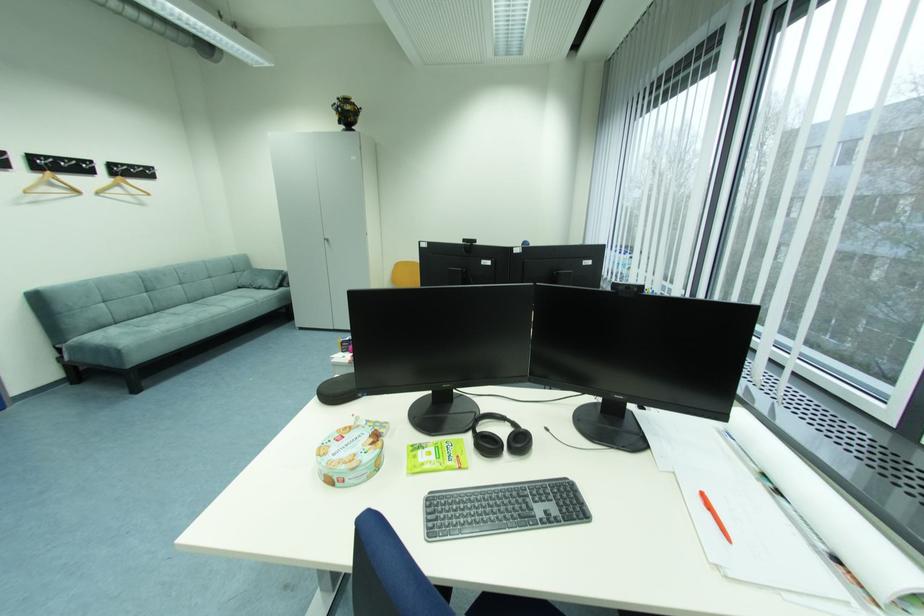
Identify the location of sofa sitting surface. (171, 328).